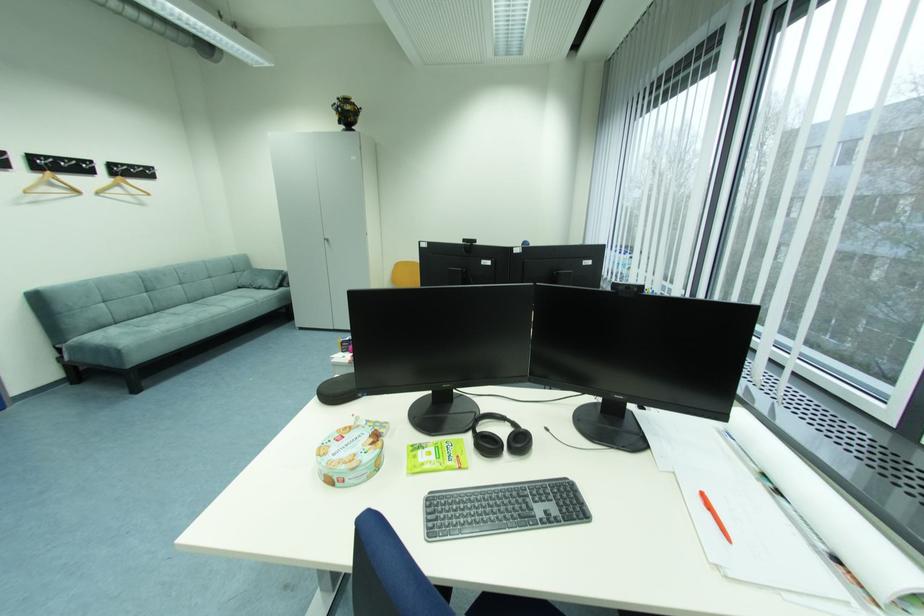
Identify the location of sofa sitting surface. (171, 328).